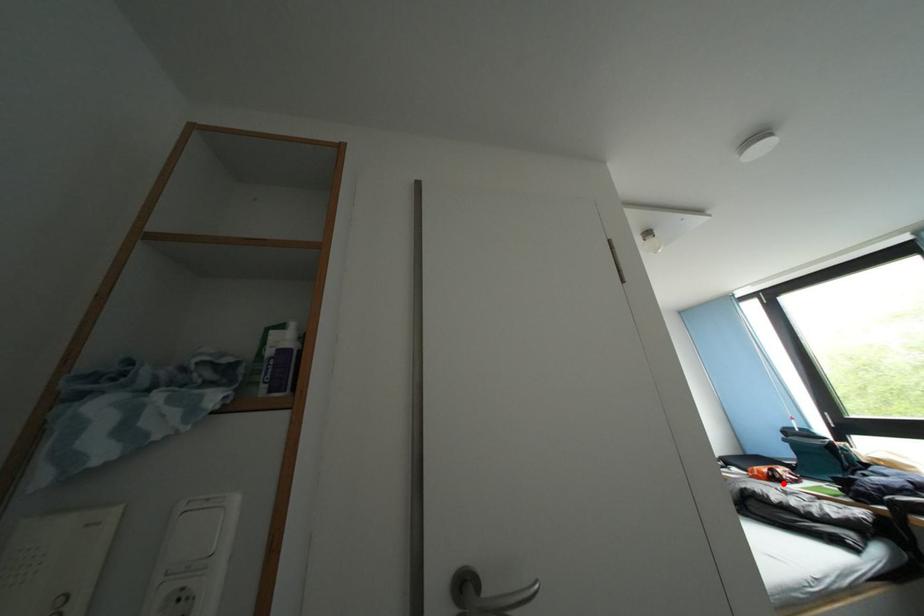
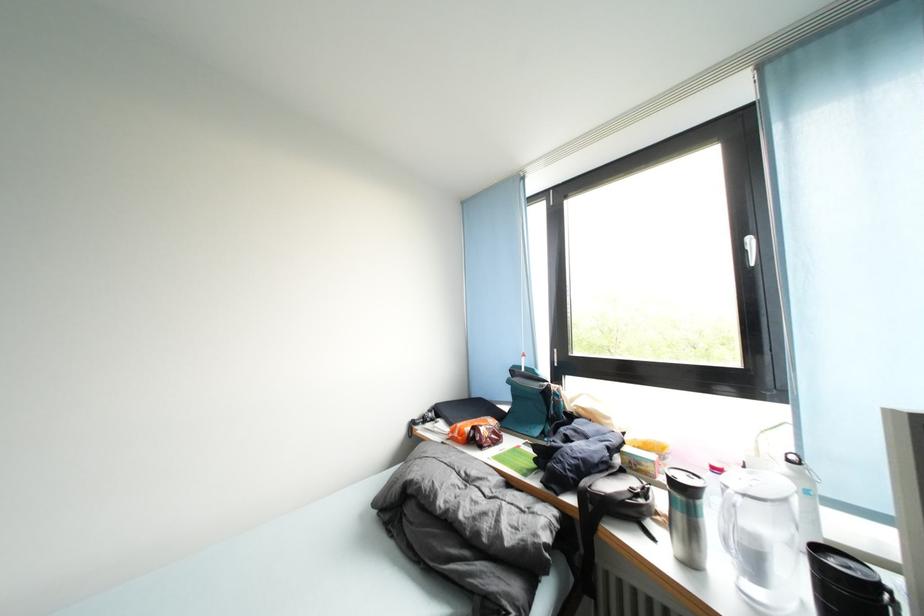
In the second image, find the point that corresponds to the highlighted location in the first image.

(482, 446)